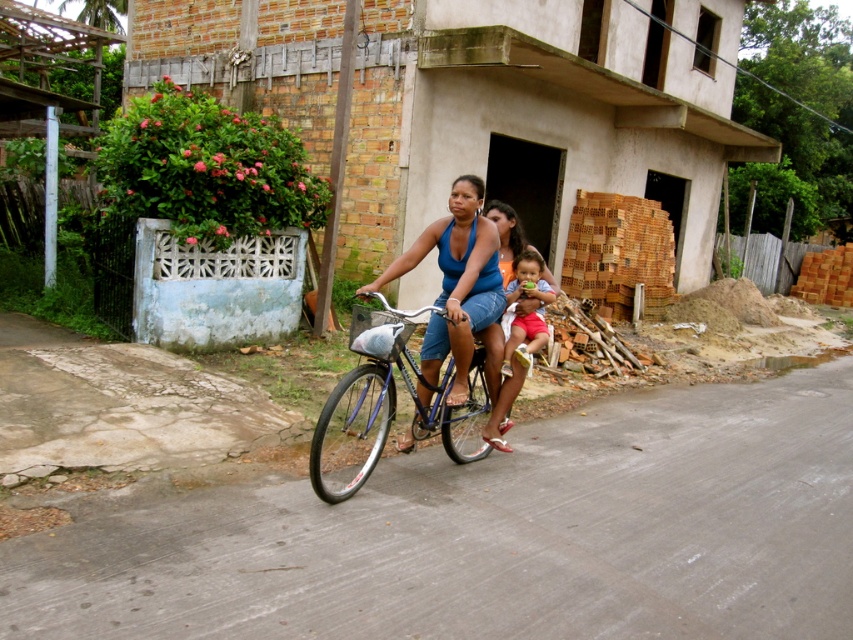
Looking at this image, is blue fabric tank top at center shorter than matte red shorts at center?

No, blue fabric tank top at center is not shorter than matte red shorts at center.

Is point (436, 224) farther from viewer compared to point (546, 340)?

No.

Locate an element on the screen. This screenshot has height=640, width=853. blue fabric tank top at center is located at coordinates (456, 282).

Is point (372, 435) positioned after point (486, 332)?

Yes.

What do you see at coordinates (389, 410) in the screenshot?
I see `shiny blue bicycle at center` at bounding box center [389, 410].

Who is more forward, (x=355, y=444) or (x=498, y=419)?

Point (x=498, y=419)

Image resolution: width=853 pixels, height=640 pixels. I want to click on shiny blue bicycle at center, so click(389, 410).

Consider the image. Is shiny blue bicycle at center below blue fabric tank top at center?

Yes.

The height and width of the screenshot is (640, 853). In order to click on shiny blue bicycle at center in this screenshot , I will do `click(389, 410)`.

Image resolution: width=853 pixels, height=640 pixels. Find the location of `shiny blue bicycle at center`. shiny blue bicycle at center is located at coordinates (389, 410).